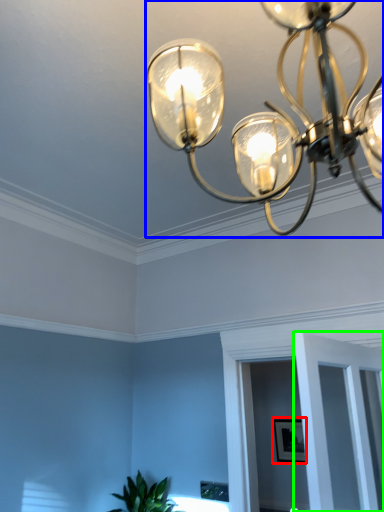
Question: Estimate the real-world distances between objects in this image. Which object is closer to picture frame (highlighted by a red box), lamp (highlighted by a blue box) or glass door (highlighted by a green box)?

Choices:
 (A) lamp
 (B) glass door

Answer: (B)